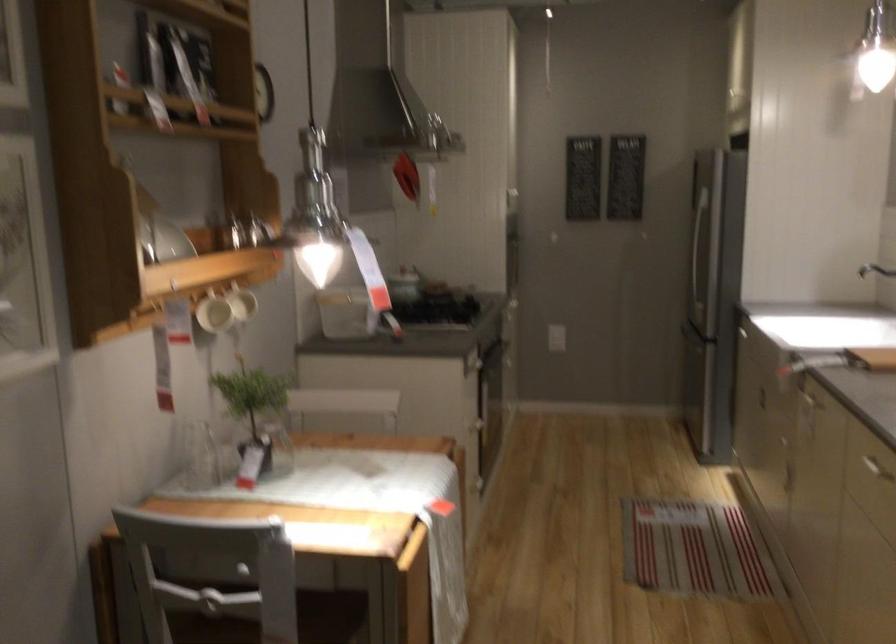
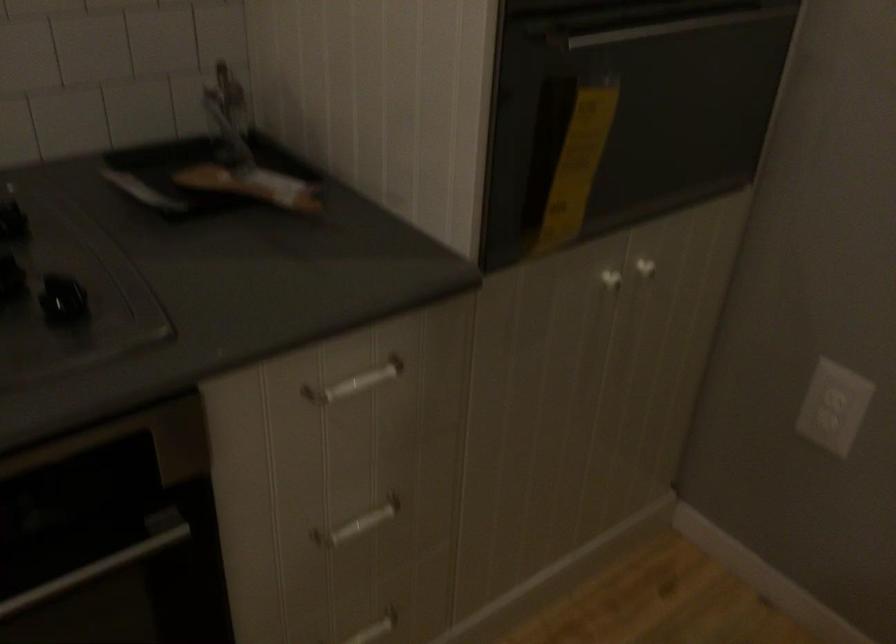
Where in the second image is the point corresponding to [530,289] from the first image?

(609, 278)